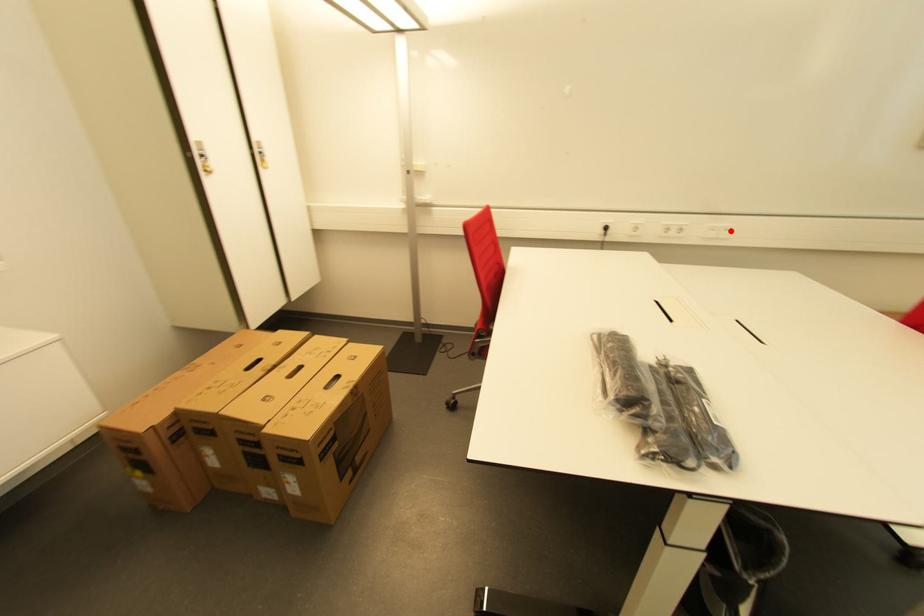
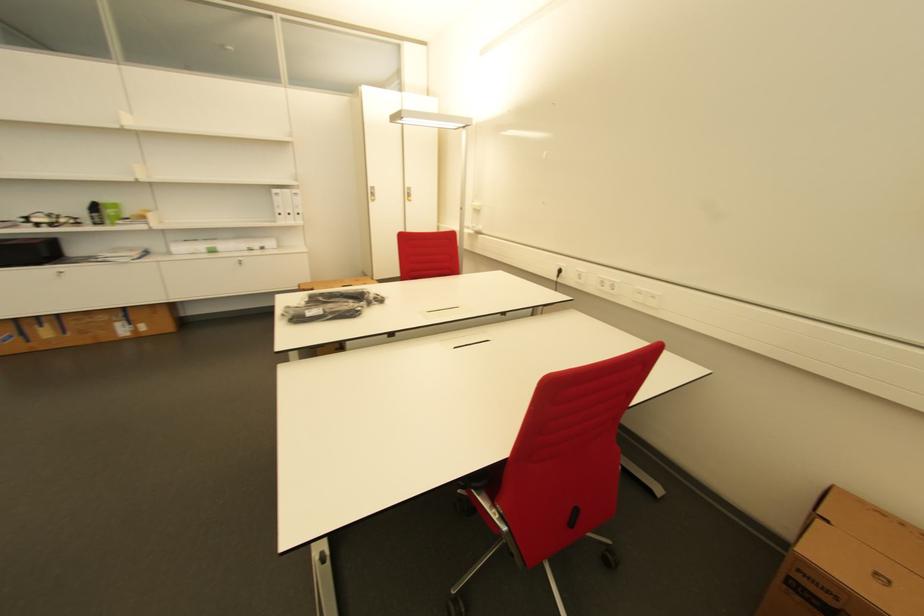
The point at the highlighted location is marked in the first image. Where is the corresponding point in the second image?

(659, 299)